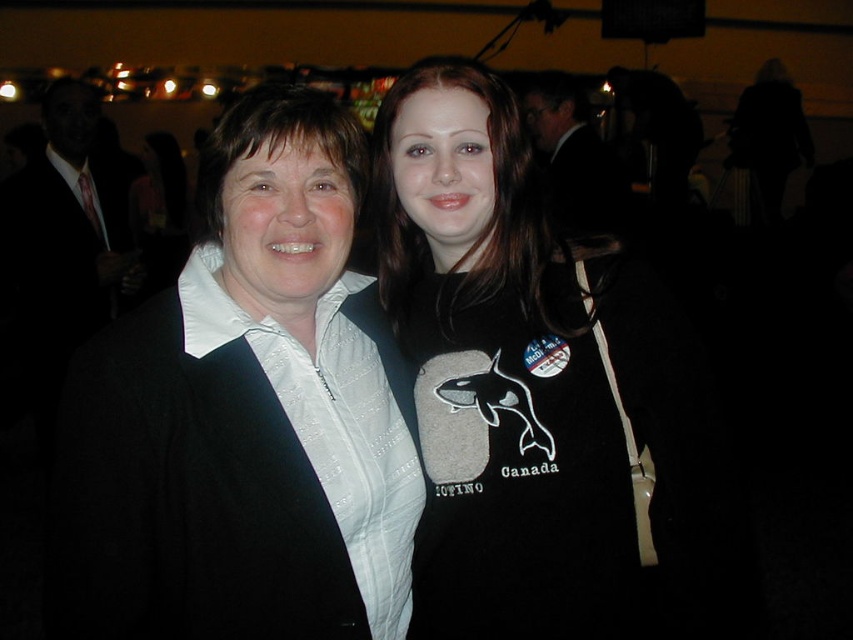
Does matte black jacket at left appear on the right side of black matte sweatshirt at center?

No, matte black jacket at left is not to the right of black matte sweatshirt at center.

Does point (113, 400) come farther from viewer compared to point (399, 332)?

No, it is not.

You are a GUI agent. You are given a task and a screenshot of the screen. Output one action in this format:
    pyautogui.click(x=<x>, y=<y>)
    Task: Click on the matte black jacket at left
    
    Given the screenshot: What is the action you would take?
    pyautogui.click(x=244, y=417)

Is black matte sweatshirt at center below black fleece sweatshirt at center?

No, black matte sweatshirt at center is not below black fleece sweatshirt at center.

Identify the location of black matte sweatshirt at center. (527, 381).

The image size is (853, 640). What do you see at coordinates (244, 417) in the screenshot?
I see `matte black jacket at left` at bounding box center [244, 417].

Is point (297, 236) farther from camera compared to point (621, 572)?

No, it is in front of (621, 572).

This screenshot has height=640, width=853. Describe the element at coordinates (244, 417) in the screenshot. I see `matte black jacket at left` at that location.

Find the location of a particular element. matte black jacket at left is located at coordinates click(x=244, y=417).